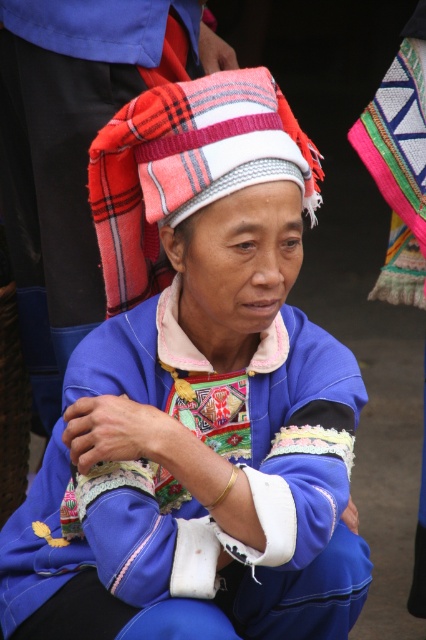
Between point (68, 125) and point (276, 109), which one is positioned behind?

The point (68, 125) is more distant.

Is matte blue fabric at center taller than knitted woolen hat at center?

Correct, matte blue fabric at center is much taller as knitted woolen hat at center.

Locate an element on the screen. This screenshot has width=426, height=640. matte blue fabric at center is located at coordinates (66, 154).